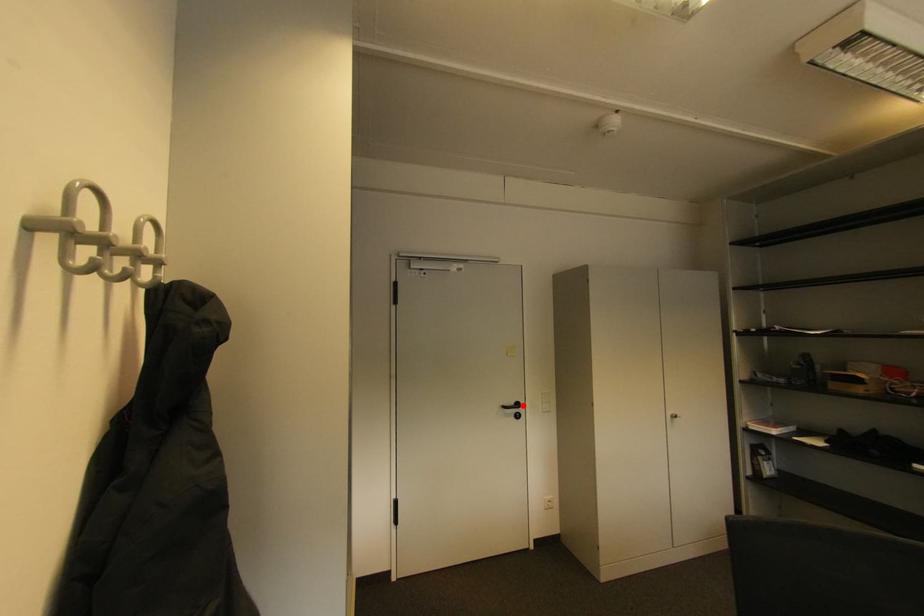
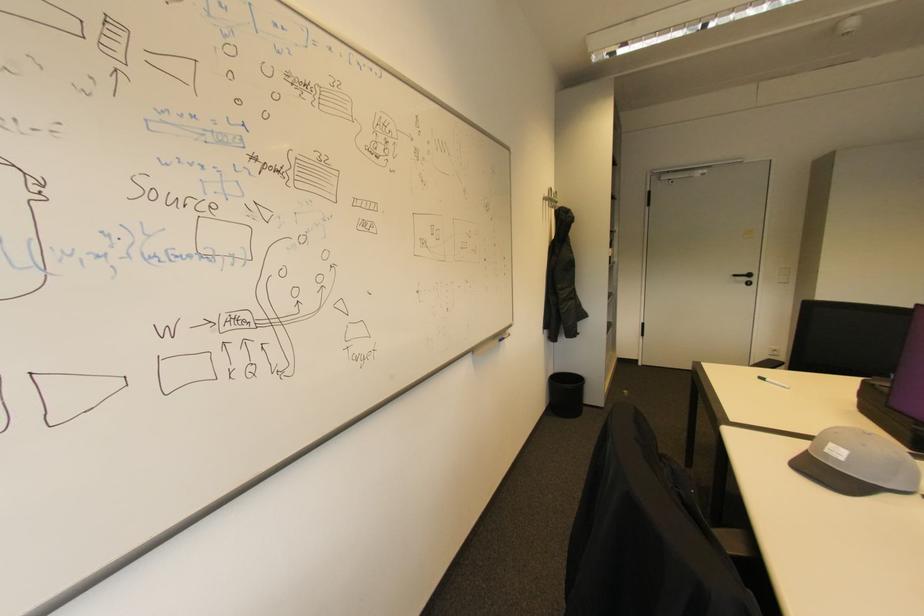
Where in the second image is the point corresponding to the highlighted location from the first image?

(755, 276)